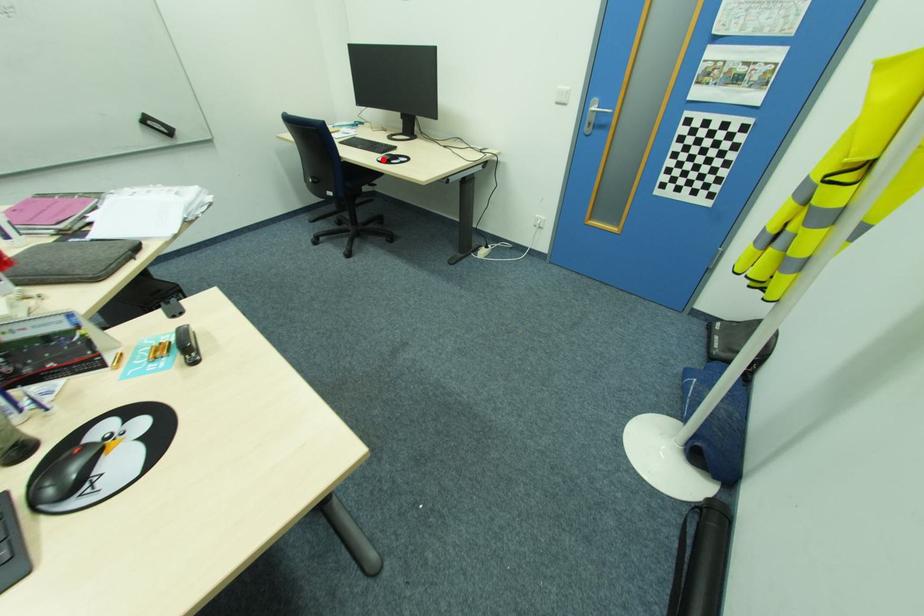
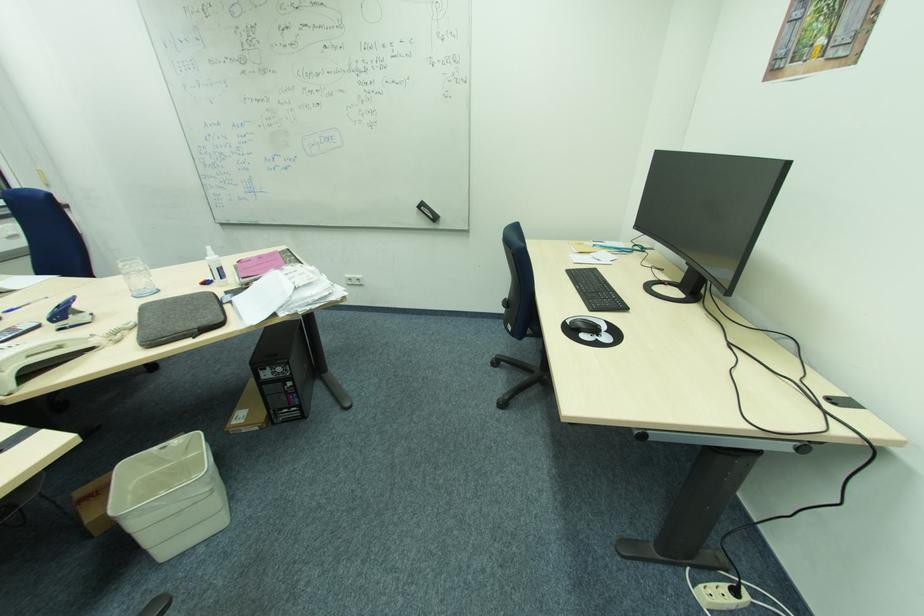
Question: A red point is marked in image1. In image2, is the corresponding 3D point closer to the camera or farther? Reply with the corresponding letter.

Choices:
 (A) The corresponding 3D point is closer.
 (B) The corresponding 3D point is farther.

Answer: (B)